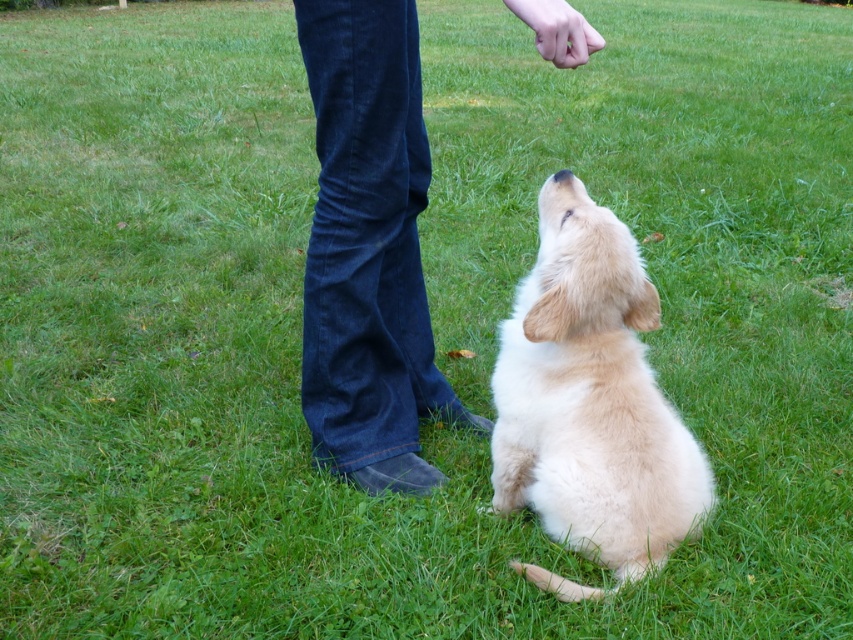
Describe the element at coordinates (369, 250) in the screenshot. The height and width of the screenshot is (640, 853). I see `denim jeans at center` at that location.

Does denim jeans at center have a larger size compared to soft golden fur at center?

Yes.

The height and width of the screenshot is (640, 853). Describe the element at coordinates (369, 250) in the screenshot. I see `denim jeans at center` at that location.

The width and height of the screenshot is (853, 640). Find the location of `denim jeans at center`. denim jeans at center is located at coordinates (369, 250).